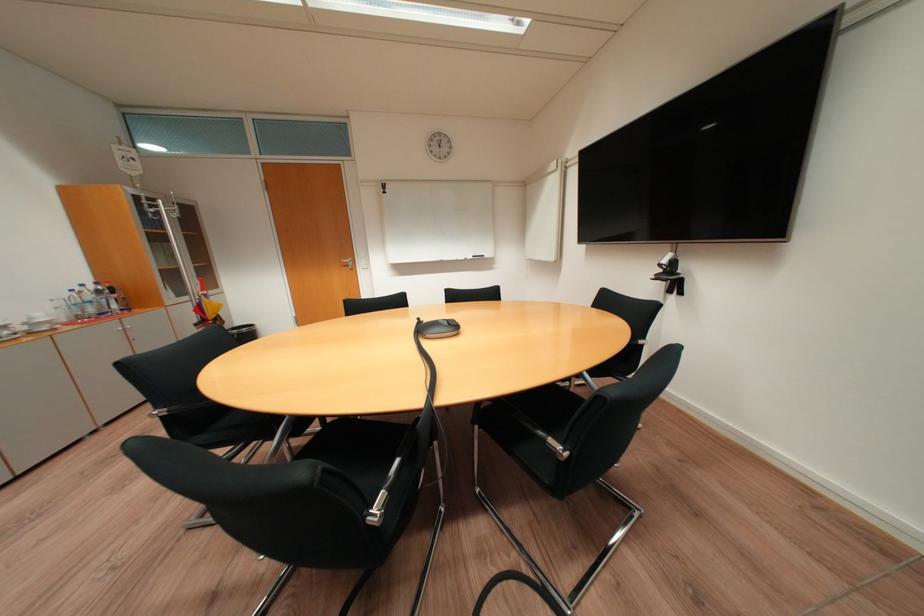
Image resolution: width=924 pixels, height=616 pixels. What do you see at coordinates (555, 435) in the screenshot?
I see `the black chair sitting surface` at bounding box center [555, 435].